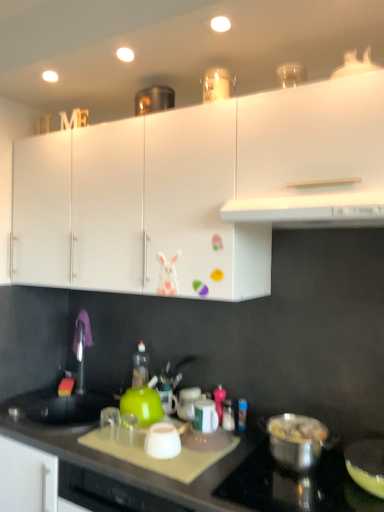
Question: Looking at their shapes, would you say shiny metallic pot at lower right, which is the first kitchen appliance from right to left, is wider or thinner than white glossy jar at center?

Choices:
 (A) wide
 (B) thin

Answer: (A)

Question: From the image's perspective, is shiny metallic pot at lower right, which is the first kitchen appliance from right to left, located above or below white glossy jar at center?

Choices:
 (A) above
 (B) below

Answer: (B)

Question: Which is nearer to the white matte cabinet at center, placed as the 2th cabinetry when sorted from right to left?

Choices:
 (A) white plastic exhaust hood at upper center
 (B) black matte countertop at lower center
 (C) green matte kettle at center, the fourth kitchen appliance when ordered from right to left
 (D) white glossy jar at center
 (E) white glossy cabinet at upper center, which is the 1th cabinetry from left to right

Answer: (A)

Question: Which is nearer to the white glossy cups at center, the second kitchen appliance positioned from the right?

Choices:
 (A) shiny metallic pot at lower right, acting as the 4th kitchen appliance starting from the left
 (B) black matte countertop at lower center
 (C) white matte cabinet at upper center, arranged as the 1th cabinetry when viewed from the right
 (D) white glossy jar at center
 (E) white glossy cup at center, which appears as the second kitchen appliance when viewed from the left

Answer: (D)